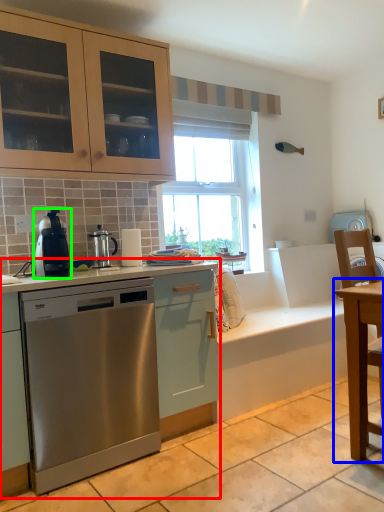
Question: Based on their relative distances, which object is farther from cabinetry (highlighted by a red box)? Choose from table (highlighted by a blue box) and home appliance (highlighted by a green box).

Choices:
 (A) table
 (B) home appliance

Answer: (A)